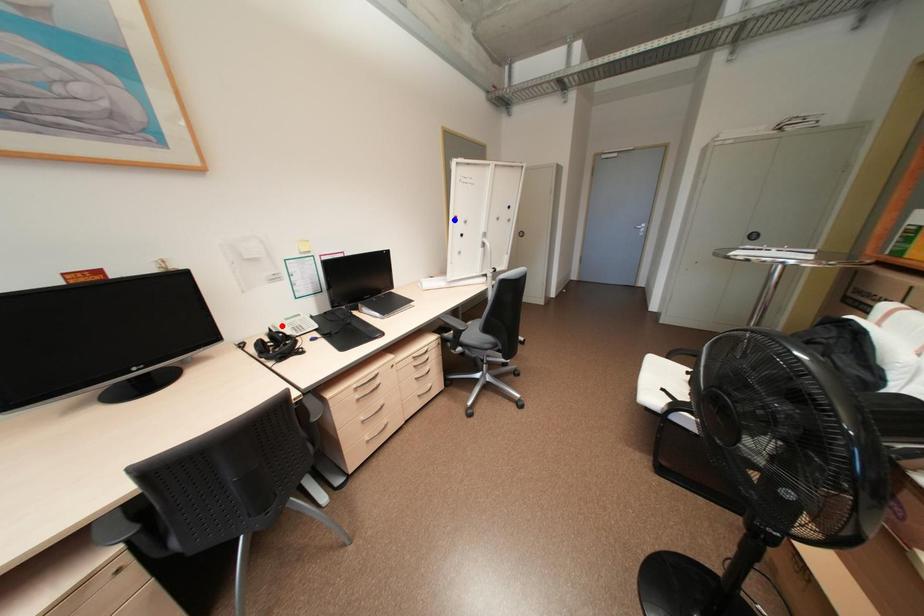
Question: In the image, two points are highlighted. Which point is nearer to the camera? Reply with the corresponding letter.

Choices:
 (A) blue point
 (B) red point

Answer: (B)